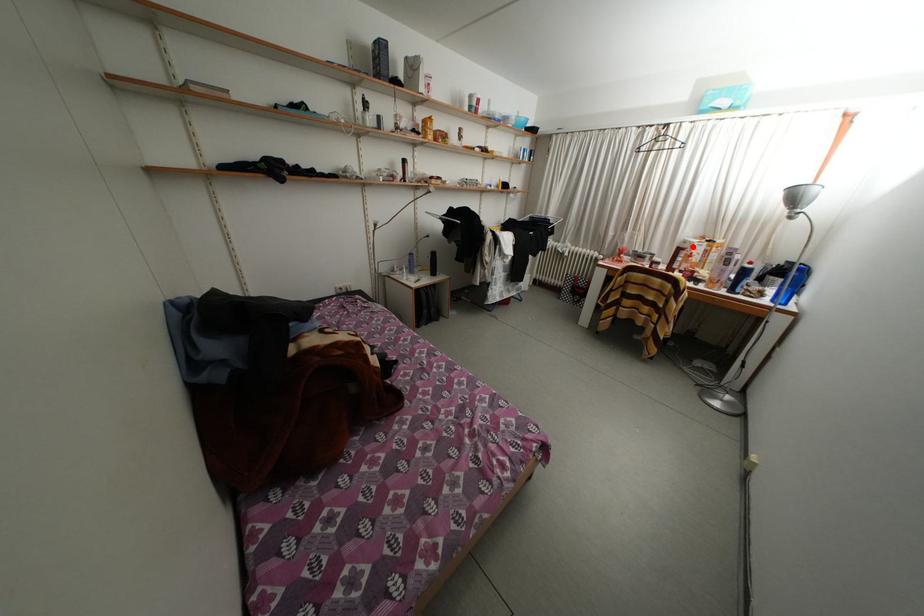
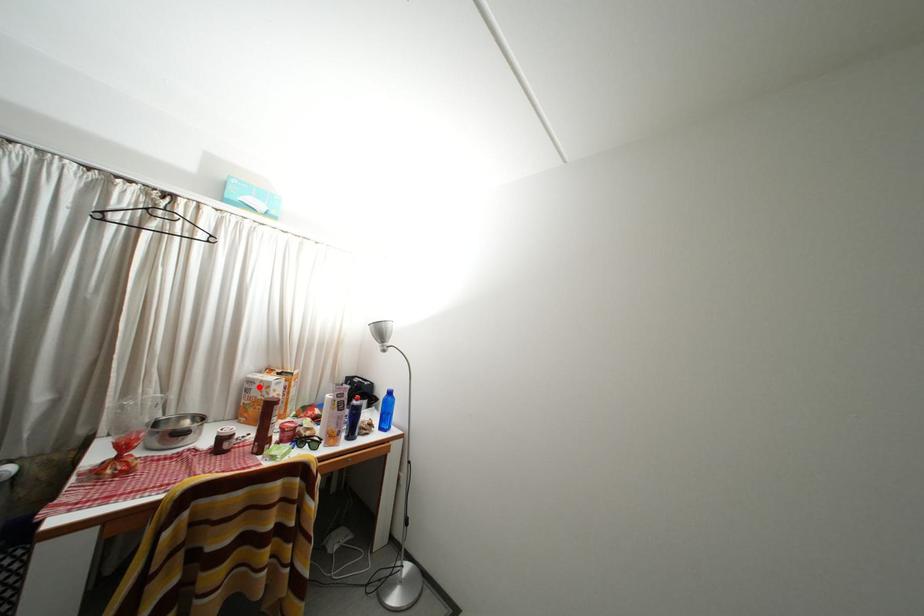
I am providing you with two images of the same scene from different viewpoints. A red point is marked on the first image and another point is marked on the second image. Is the red point in image1 aligned with the point shown in image2?

Yes